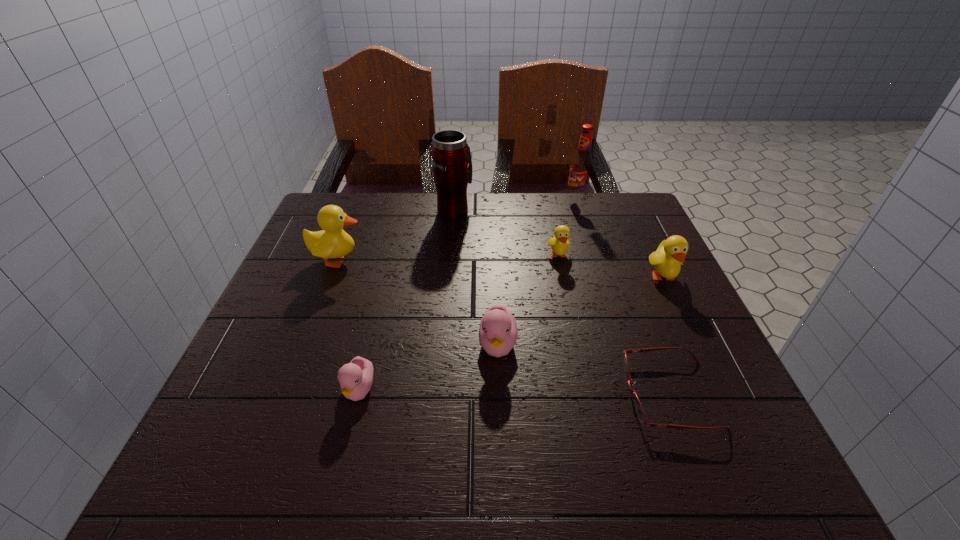
This screenshot has width=960, height=540. Identify the location of vacant space in between the second yellow duckling from left to right and the rightmost duckling. (611, 267).

The image size is (960, 540). I want to click on free space between the leftmost yellow duckling and the third duckling from right to left, so (x=418, y=302).

The width and height of the screenshot is (960, 540). In order to click on vacant area that lies between the right pink duckling and the sixth shortest object in this screenshot , I will do `click(418, 302)`.

I want to click on vacant space that is in between the seventh tallest object and the bigger pink duckling, so [428, 368].

Locate an element on the screen. Image resolution: width=960 pixels, height=540 pixels. free space that is in between the root beer and the shortest object is located at coordinates (623, 297).

This screenshot has height=540, width=960. In order to click on vacant space that is in between the red thermos bottle and the third tallest object in this screenshot , I will do point(396,235).

You are a GUI agent. You are given a task and a screenshot of the screen. Output one action in this format:
    pyautogui.click(x=<x>, y=<y>)
    Task: Click on the free area in between the shortest object and the right pink duckling
    
    Given the screenshot: What is the action you would take?
    pyautogui.click(x=584, y=370)

Identify the location of the third closest object to the second duckling from right to left. (498, 332).

Where is `object that is the nearest to the biggest yellow duckling`? object that is the nearest to the biggest yellow duckling is located at coordinates (452, 165).

Find the location of a particular element. The width and height of the screenshot is (960, 540). duckling identified as the second closest to the smallest yellow duckling is located at coordinates (498, 332).